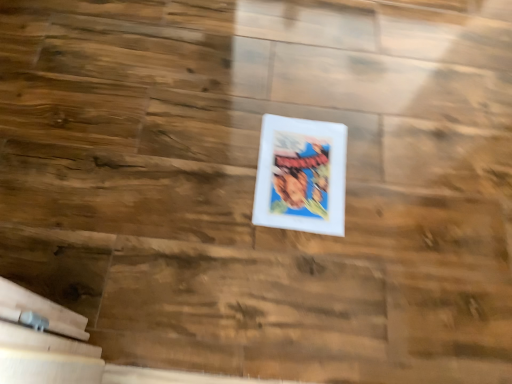
From the picture: Measure the distance between point (x=335, y=227) and camera.

A distance of 38.66 inches exists between point (x=335, y=227) and camera.

The width and height of the screenshot is (512, 384). Identify the location of white matte picture frame at center. (301, 175).

The height and width of the screenshot is (384, 512). Describe the element at coordinates (301, 175) in the screenshot. I see `white matte picture frame at center` at that location.

You are a GUI agent. You are given a task and a screenshot of the screen. Output one action in this format:
    pyautogui.click(x=<x>, y=<y>)
    Task: Click on the white matte picture frame at center
    This screenshot has width=512, height=384.
    Given the screenshot: What is the action you would take?
    pyautogui.click(x=301, y=175)